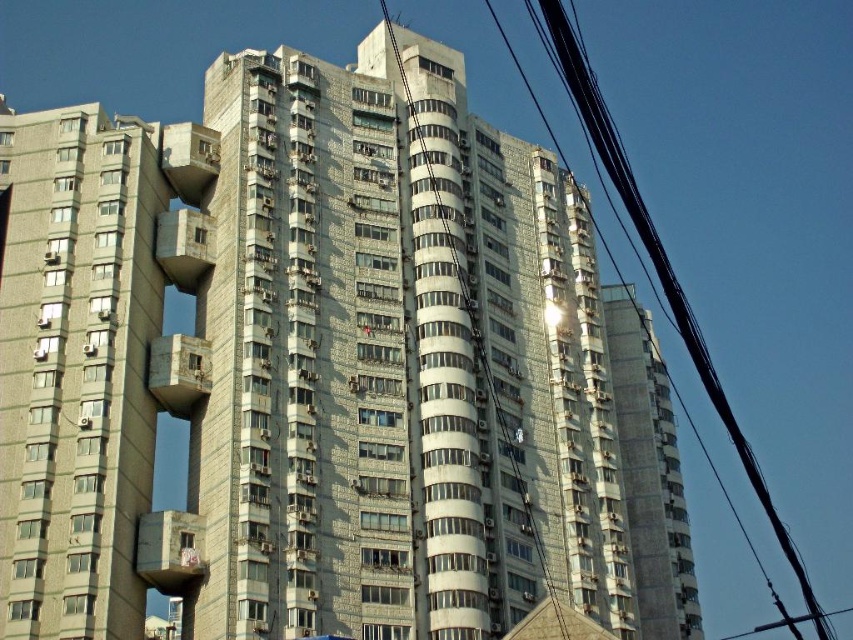
You are an electrician inspecting the power lines on a building. You notice two wires in the image, the black wire at upper right and the metallic wire at center. Which wire is positioned higher relative to the building?

The black wire at upper right is positioned higher than the metallic wire at center relative to the building.

You are a bird trying to land on the wires in the image. You see the black wire at upper right and the metallic wire at center. Which wire is thicker?

The black wire at upper right is thicker than the metallic wire at center.